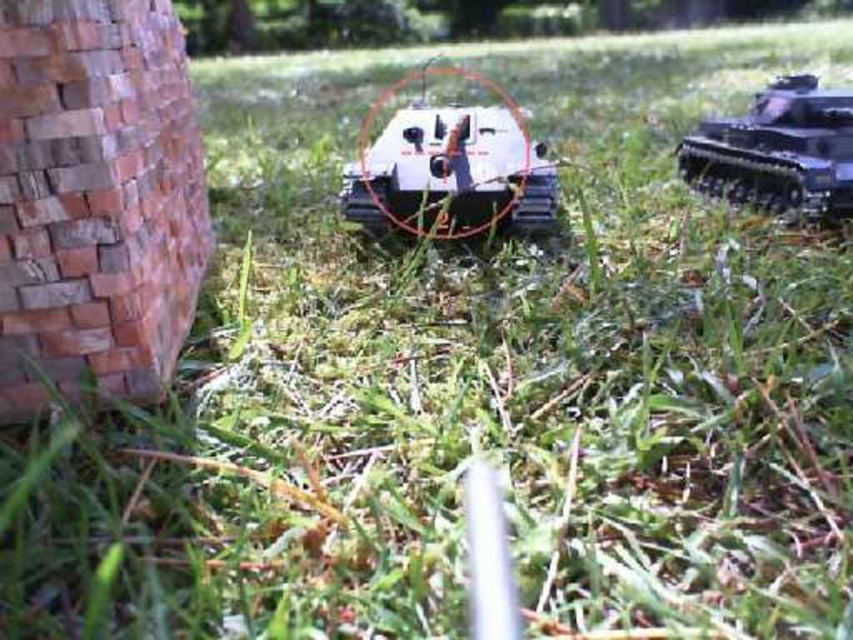
Is white plastic tank at center below shiny black tank at upper right?

Yes, white plastic tank at center is below shiny black tank at upper right.

The image size is (853, 640). What do you see at coordinates (450, 168) in the screenshot?
I see `white plastic tank at center` at bounding box center [450, 168].

Image resolution: width=853 pixels, height=640 pixels. I want to click on white plastic tank at center, so click(450, 168).